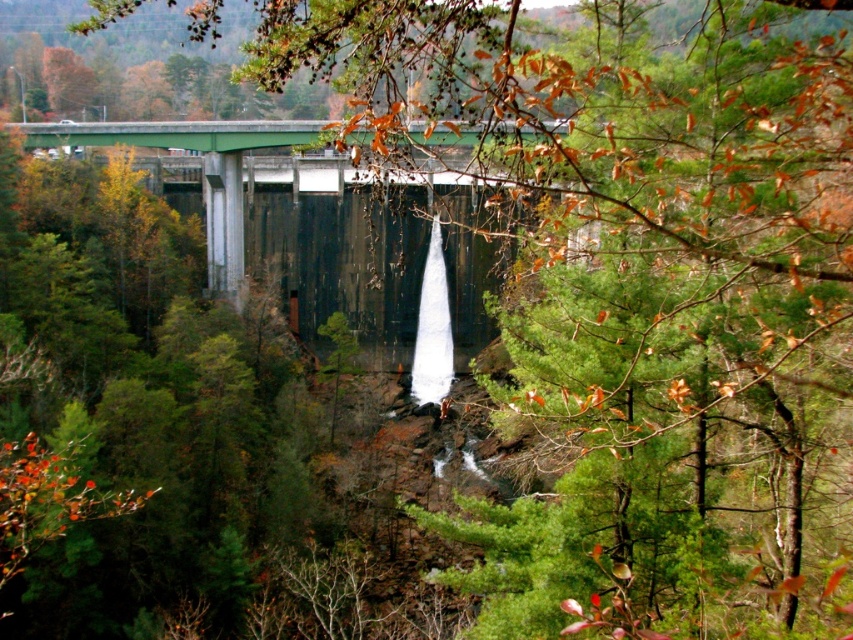
Is green concrete bridge at center taller than white frothy water at center?

Indeed, green concrete bridge at center has a greater height compared to white frothy water at center.

Can you confirm if green concrete bridge at center is positioned above white frothy water at center?

Indeed, green concrete bridge at center is positioned over white frothy water at center.

Which is in front, point (389, 326) or point (421, 314)?

Point (421, 314) is in front.

Locate an element on the screen. green concrete bridge at center is located at coordinates (281, 220).